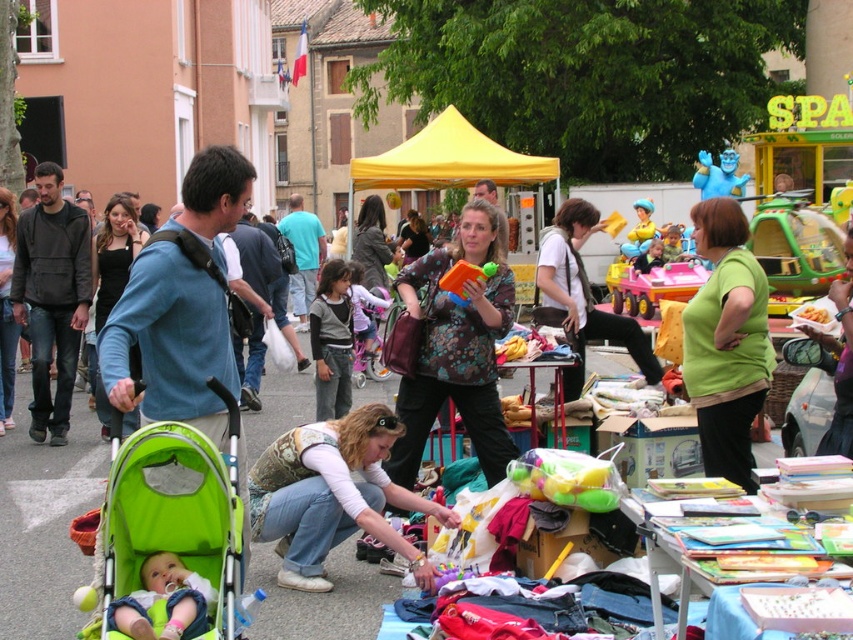
Does floral-patterned fabric at center appear on the left side of floral print blouse at center?

Incorrect, floral-patterned fabric at center is not on the left side of floral print blouse at center.

Does floral-patterned fabric at center have a greater height compared to floral print blouse at center?

Yes, floral-patterned fabric at center is taller than floral print blouse at center.

Which is behind, point (547, 269) or point (352, 230)?

The point (352, 230) is behind.

Where is `floral-patterned fabric at center`? The height and width of the screenshot is (640, 853). floral-patterned fabric at center is located at coordinates (582, 298).

Which is below, floral-patterned fabric at center or yellow fabric canopy at center?

Positioned lower is floral-patterned fabric at center.

Between point (538, 257) and point (361, 180), which one is positioned in front?

Point (538, 257)

Which is behind, point (556, 220) or point (408, 154)?

The point (408, 154) is behind.

Find the location of `floral-patterned fabric at center`. floral-patterned fabric at center is located at coordinates (582, 298).

Which is above, green fabric stroller at lower left or black fabric purse at left?

Positioned higher is black fabric purse at left.

The height and width of the screenshot is (640, 853). I want to click on green fabric stroller at lower left, so click(170, 532).

Which is behind, point (157, 525) or point (107, 234)?

Point (107, 234)

Identify the location of green fabric stroller at lower left. Image resolution: width=853 pixels, height=640 pixels. (170, 532).